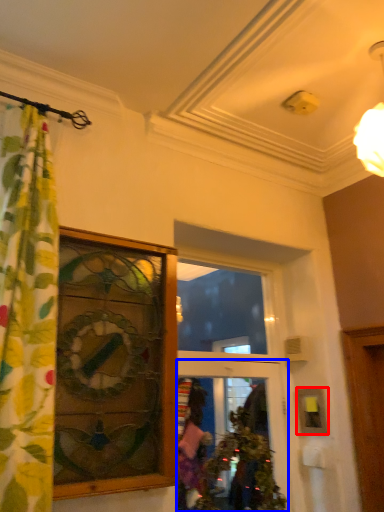
Question: Which object appears farthest to the camera in this image, picture frame (highlighted by a red box) or door (highlighted by a blue box)?

Choices:
 (A) picture frame
 (B) door

Answer: (A)